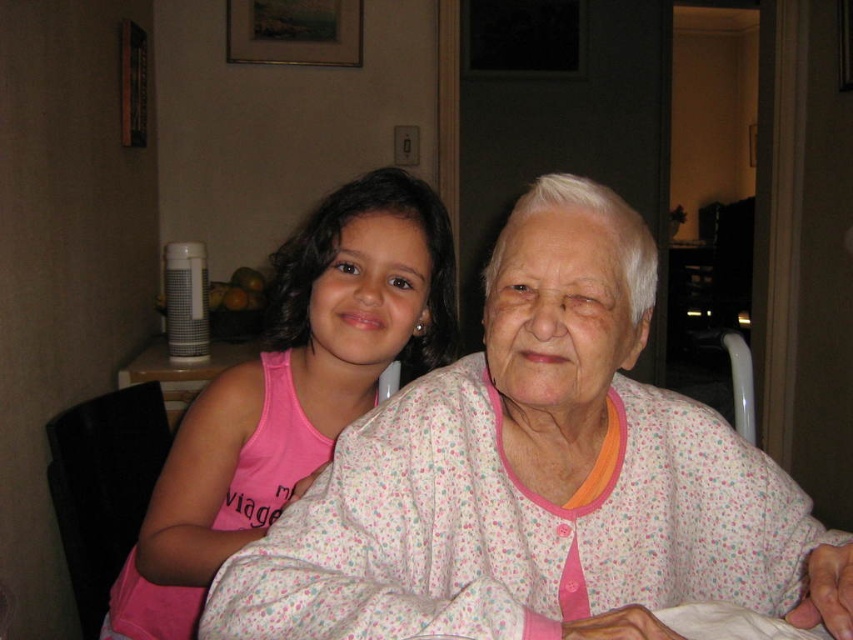
Question: Is floral cotton pajamas at center smaller than pink fabric at center?

Choices:
 (A) no
 (B) yes

Answer: (B)

Question: Is floral cotton pajamas at center bigger than pink fabric at center?

Choices:
 (A) yes
 (B) no

Answer: (B)

Question: Can you confirm if floral cotton pajamas at center is thinner than pink fabric at center?

Choices:
 (A) yes
 (B) no

Answer: (B)

Question: Among these objects, which one is farthest from the camera?

Choices:
 (A) pink fabric at center
 (B) floral cotton pajamas at center

Answer: (A)